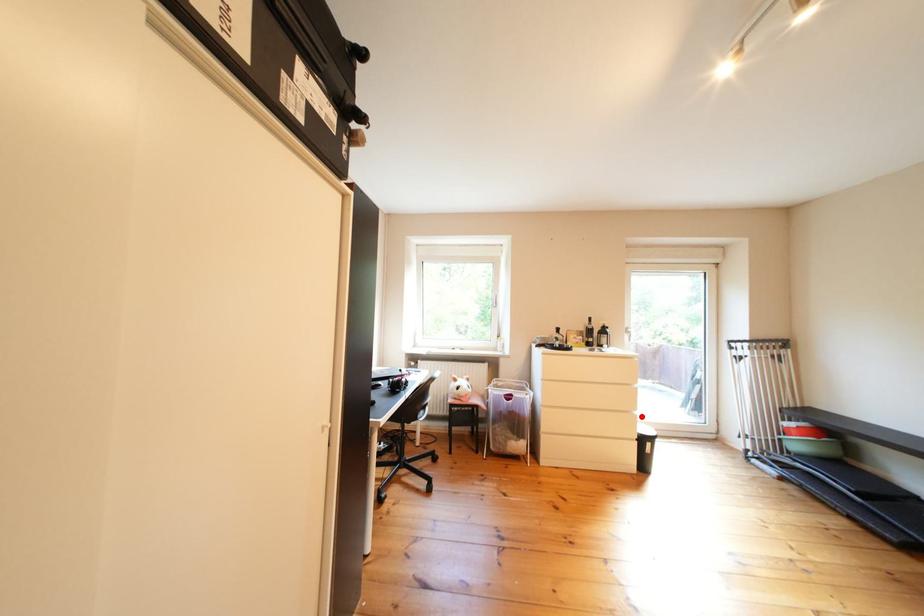
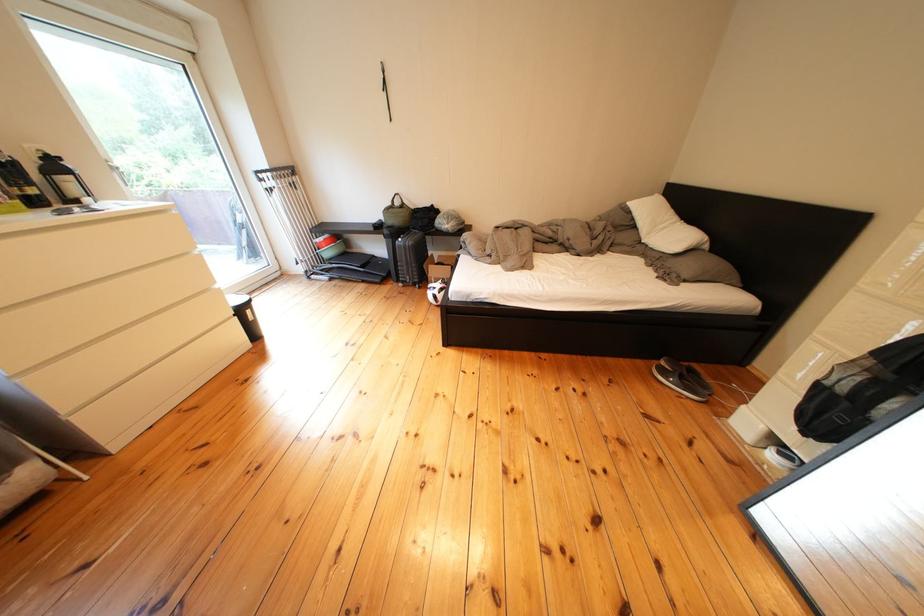
Locate, in the second image, the point that corresponds to the highlighted location in the first image.

(220, 294)